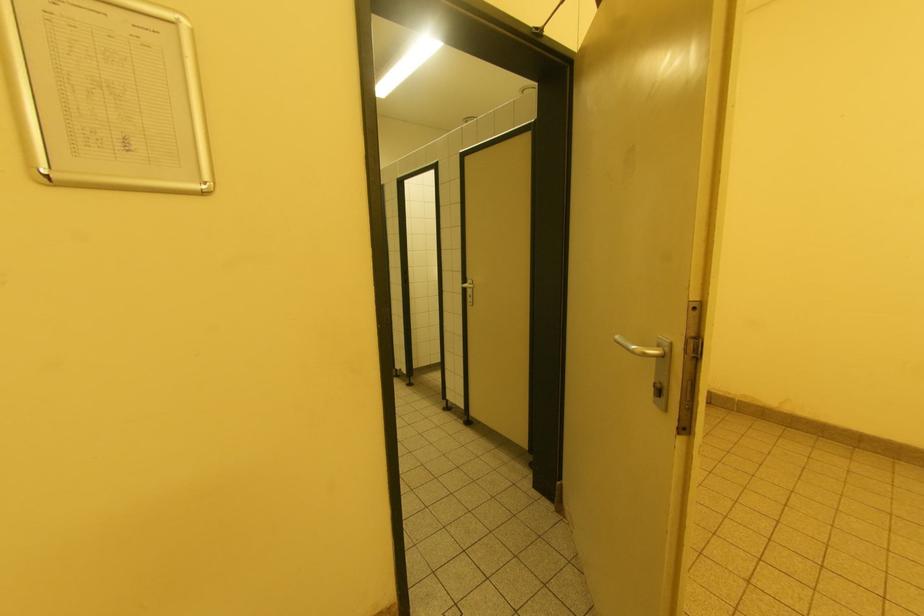
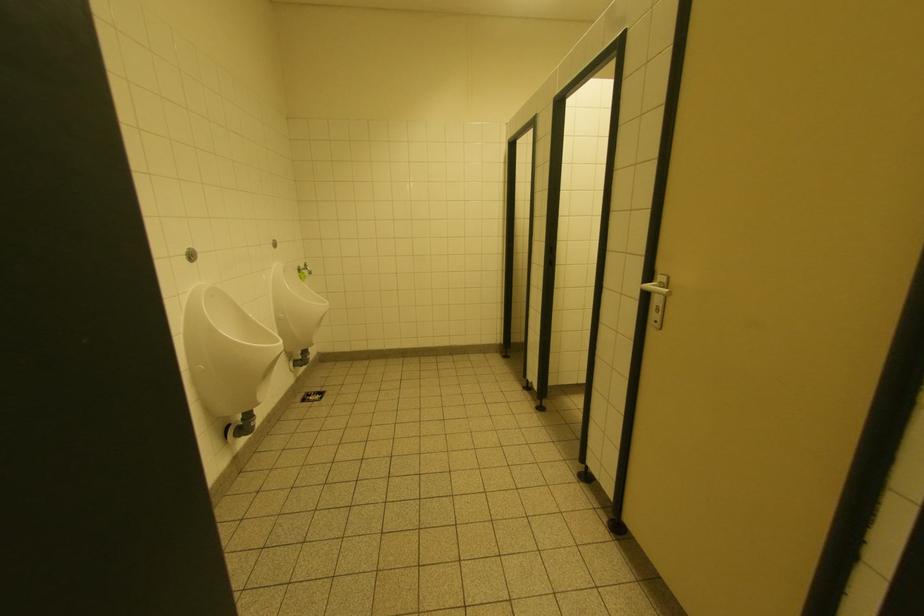
Question: The first image is from the beginning of the video and the second image is from the end. How did the camera likely rotate when shooting the video?

Choices:
 (A) Left
 (B) Right
 (C) Up
 (D) Down

Answer: (A)